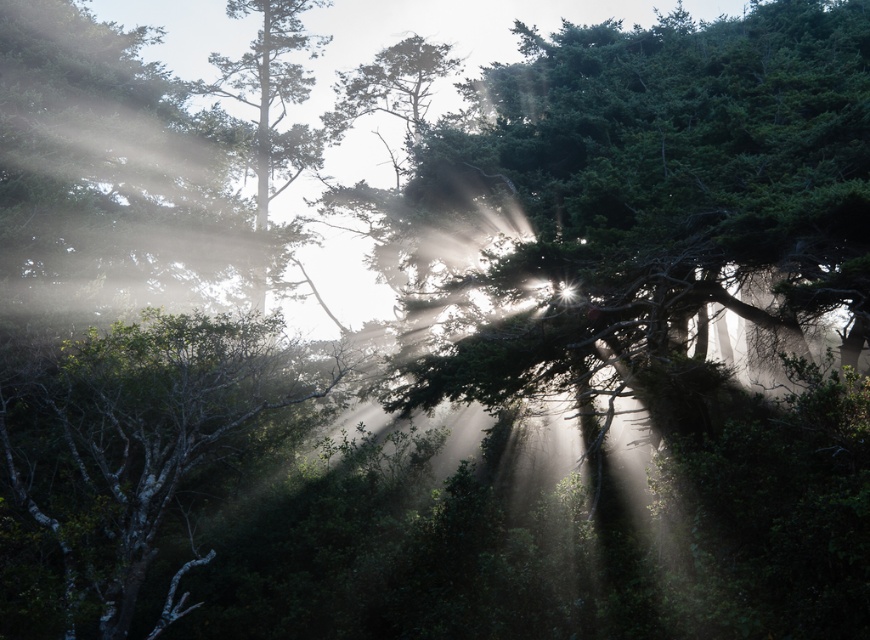
Does green matte tree at lower left appear over green matte tree at center?

Actually, green matte tree at lower left is below green matte tree at center.

Can you confirm if green matte tree at lower left is positioned to the right of green matte tree at center?

Yes, green matte tree at lower left is to the right of green matte tree at center.

You are a GUI agent. You are given a task and a screenshot of the screen. Output one action in this format:
    pyautogui.click(x=<x>, y=<y>)
    Task: Click on the green matte tree at lower left
    The image size is (870, 640).
    Given the screenshot: What is the action you would take?
    coord(135,438)

Is green matte tree at upper left below green matte tree at center?

Yes.

Who is lower down, green matte tree at upper left or green matte tree at center?

green matte tree at upper left

Find the location of a particular element. green matte tree at upper left is located at coordinates (108, 176).

Does green matte tree at upper left have a larger size compared to green matte tree at lower left?

Correct, green matte tree at upper left is larger in size than green matte tree at lower left.

Measure the distance from green matte tree at upper left to green matte tree at lower left.

A distance of 6.62 meters exists between green matte tree at upper left and green matte tree at lower left.

Consider the image. Who is more distant from viewer, (211, 128) or (146, 476)?

The point (211, 128) is behind.

Where is `green matte tree at upper left`? The image size is (870, 640). green matte tree at upper left is located at coordinates (108, 176).